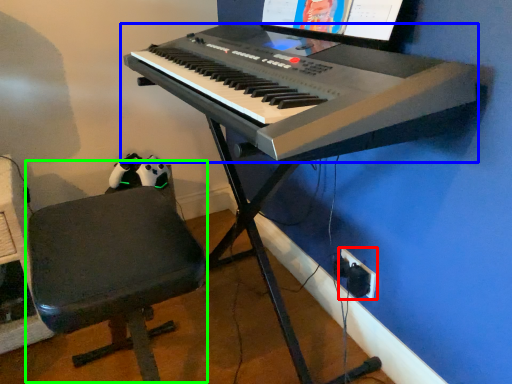
Question: Considering the real-world distances, which object is farthest from plug (highlighted by a red box)? musical keyboard (highlighted by a blue box) or computer chair (highlighted by a green box)?

Choices:
 (A) musical keyboard
 (B) computer chair

Answer: (B)